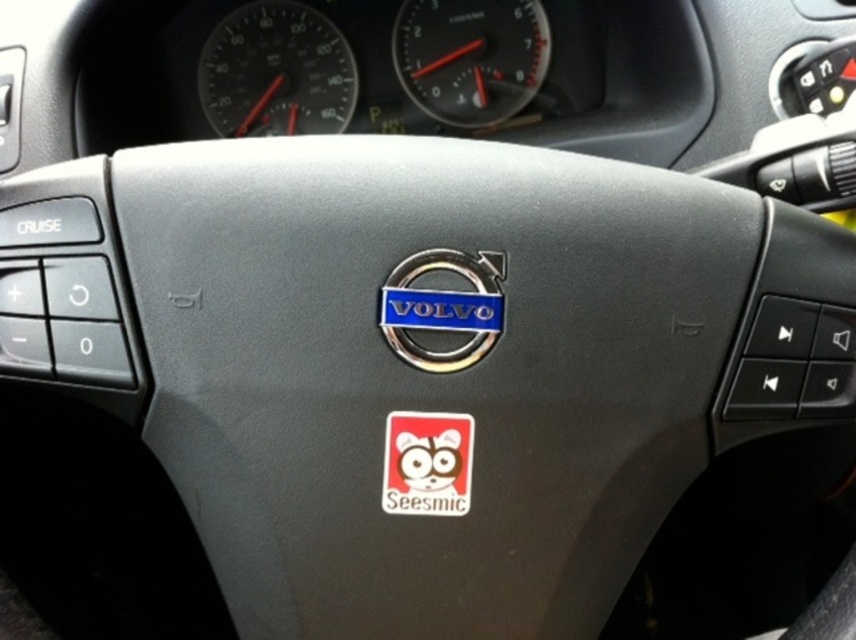
Who is positioned more to the left, matte black speedometer at upper center or red matte sticker at center?

matte black speedometer at upper center

Which is in front, point (211, 51) or point (429, 504)?

Positioned in front is point (429, 504).

Find the location of a particular element. matte black speedometer at upper center is located at coordinates (276, 72).

Describe the element at coordinates (470, 58) in the screenshot. This screenshot has width=856, height=640. I see `metallic silver speedometer at upper center` at that location.

Between metallic silver speedometer at upper center and red matte sticker at center, which one has less height?

red matte sticker at center

This screenshot has width=856, height=640. What do you see at coordinates (470, 58) in the screenshot?
I see `metallic silver speedometer at upper center` at bounding box center [470, 58].

Find the location of a particular element. The width and height of the screenshot is (856, 640). metallic silver speedometer at upper center is located at coordinates (470, 58).

Does point (265, 65) come in front of point (462, 45)?

Yes, it is.

Does matte black speedometer at upper center have a greater height compared to metallic silver speedometer at upper center?

Yes.

Where is `matte black speedometer at upper center`? matte black speedometer at upper center is located at coordinates (276, 72).